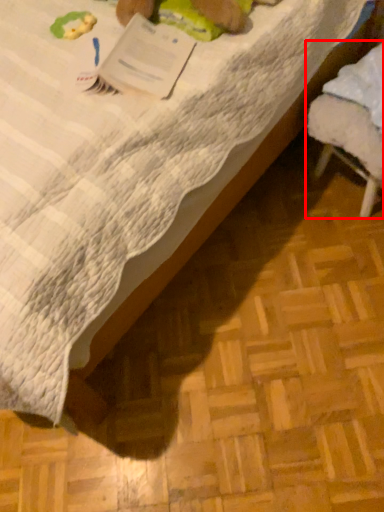
Question: From the image's perspective, where is furniture (annotated by the red box) located in relation to paperback book in the image?

Choices:
 (A) below
 (B) above

Answer: (A)